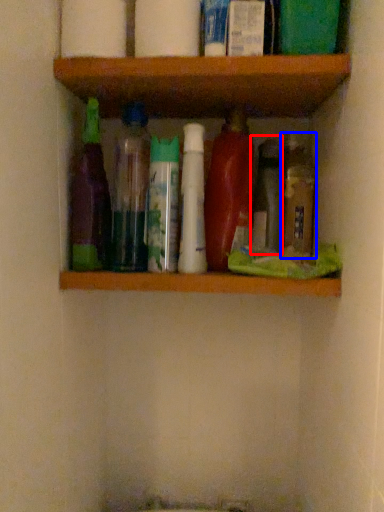
Question: Which object appears closest to the camera in this image, bottle (highlighted by a red box) or bottle (highlighted by a blue box)?

Choices:
 (A) bottle
 (B) bottle

Answer: (B)